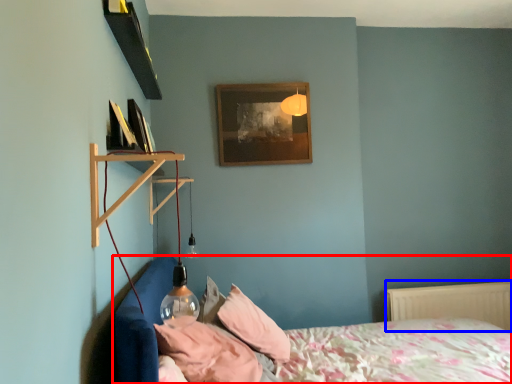
Question: Which of the following is the farthest to the observer, bed (highlighted by a red box) or radiator (highlighted by a blue box)?

Choices:
 (A) bed
 (B) radiator

Answer: (B)